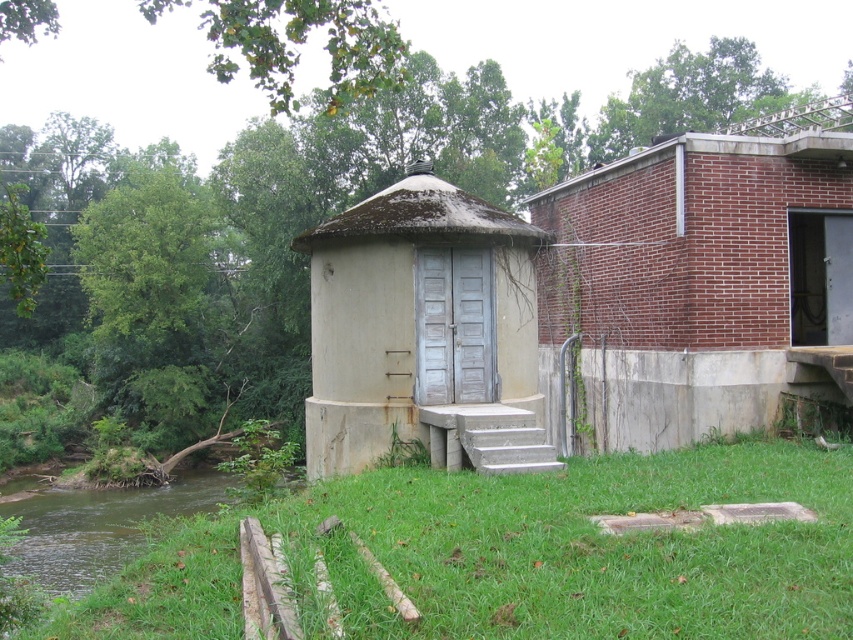
Question: Which object is closer to the camera taking this photo?

Choices:
 (A) light gray concrete hut at center
 (B) brick wall at right

Answer: (A)

Question: Considering the relative positions of green grass at lower center and concrete/steps at lower center in the image provided, where is green grass at lower center located with respect to concrete/steps at lower center?

Choices:
 (A) above
 (B) below

Answer: (B)

Question: Which of the following is the farthest from the observer?

Choices:
 (A) concrete/steps at lower center
 (B) brick wall at right

Answer: (B)

Question: Does green grass at lower center appear under brick wall at right?

Choices:
 (A) yes
 (B) no

Answer: (A)

Question: Which of the following is the farthest from the observer?

Choices:
 (A) [x=624, y=276]
 (B) [x=486, y=417]
 (C) [x=795, y=538]

Answer: (A)

Question: Can you confirm if brick wall at right is wider than light gray concrete hut at center?

Choices:
 (A) yes
 (B) no

Answer: (A)